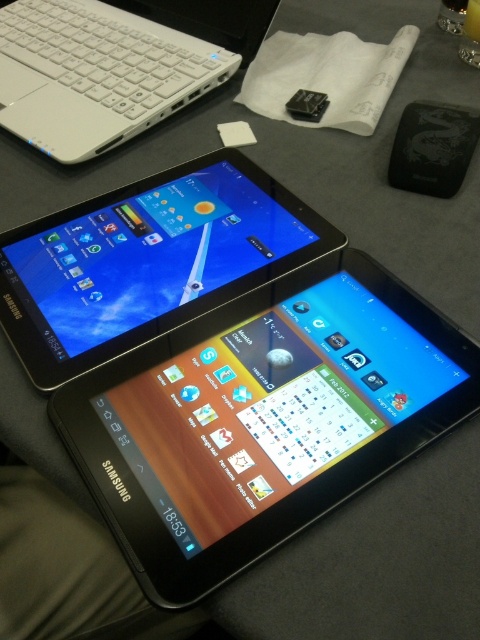
Does black glossy tablet at upper center have a lesser width compared to black matte ipod at upper right?

No.

Can you confirm if black glossy tablet at upper center is positioned to the left of black matte ipod at upper right?

Indeed, black glossy tablet at upper center is positioned on the left side of black matte ipod at upper right.

Between point (62, 298) and point (435, 129), which one is positioned in front?

Positioned in front is point (62, 298).

At what (x,y) coordinates should I click in order to perform the action: click on black glossy tablet at upper center. Please return your answer as a coordinate pair (x, y). The image size is (480, 640). Looking at the image, I should click on (147, 260).

Can you confirm if white plastic laptop at upper left is positioned to the right of black matte ipod at upper right?

No, white plastic laptop at upper left is not to the right of black matte ipod at upper right.

Image resolution: width=480 pixels, height=640 pixels. In order to click on white plastic laptop at upper left in this screenshot , I will do `click(116, 65)`.

This screenshot has height=640, width=480. I want to click on white plastic laptop at upper left, so click(116, 65).

Between black glossy tablet at upper center and white plastic laptop at upper left, which one appears on the left side from the viewer's perspective?

white plastic laptop at upper left

Which is more to the right, black glossy tablet at upper center or white plastic laptop at upper left?

From the viewer's perspective, black glossy tablet at upper center appears more on the right side.

Is point (104, 285) in front of point (113, 36)?

Yes, point (104, 285) is in front of point (113, 36).

Where is `black glossy tablet at upper center`? The image size is (480, 640). black glossy tablet at upper center is located at coordinates (147, 260).